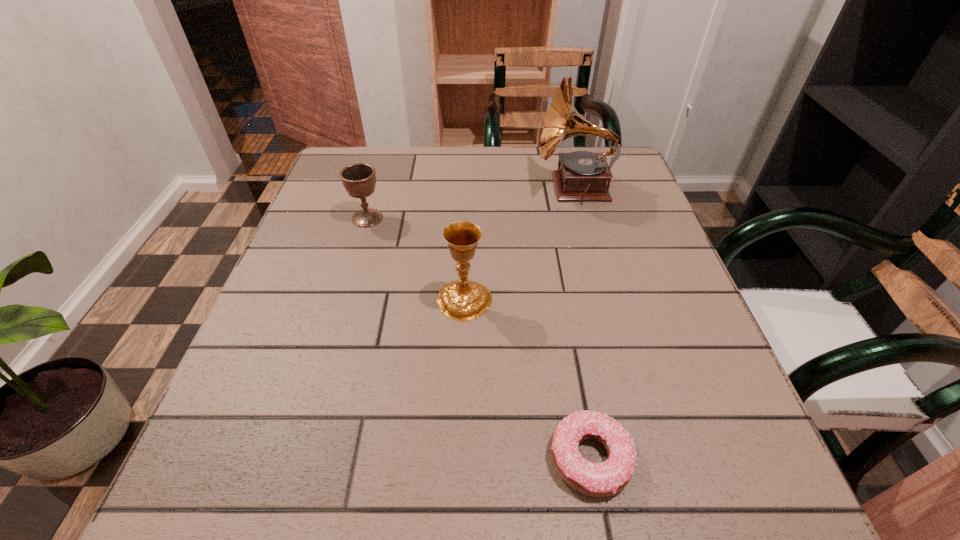
Locate an element on the screen. This screenshot has width=960, height=540. phonograph_record is located at coordinates (583, 175).

Find the location of a particular element. the second object from left to right is located at coordinates (463, 300).

The width and height of the screenshot is (960, 540). In order to click on the second tallest object in this screenshot , I will do `click(463, 300)`.

Locate an element on the screen. The height and width of the screenshot is (540, 960). the leftmost object is located at coordinates (359, 179).

Identify the location of the left chalice. (359, 179).

This screenshot has width=960, height=540. What are the coordinates of `the shortest object` in the screenshot? It's located at (608, 478).

Locate an element on the screen. This screenshot has width=960, height=540. doughnut is located at coordinates (608, 478).

This screenshot has height=540, width=960. In order to click on vacant space positioned on the horn of the phonograph_record in this screenshot , I will do `click(378, 187)`.

Find the location of a particular element. free location located on the horn of the phonograph_record is located at coordinates (406, 187).

This screenshot has height=540, width=960. Identify the location of free space located 0.110m on the horn of the phonograph_record. (493, 187).